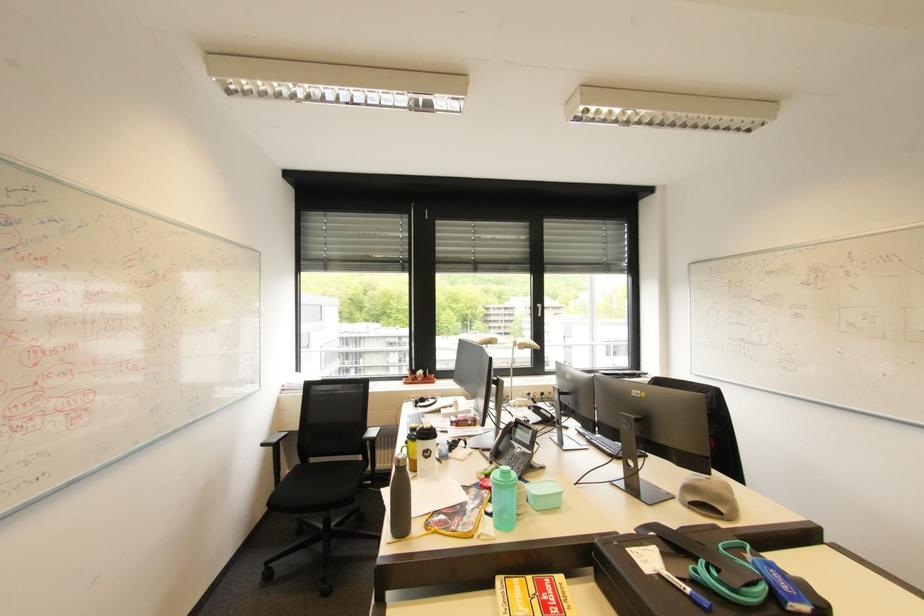
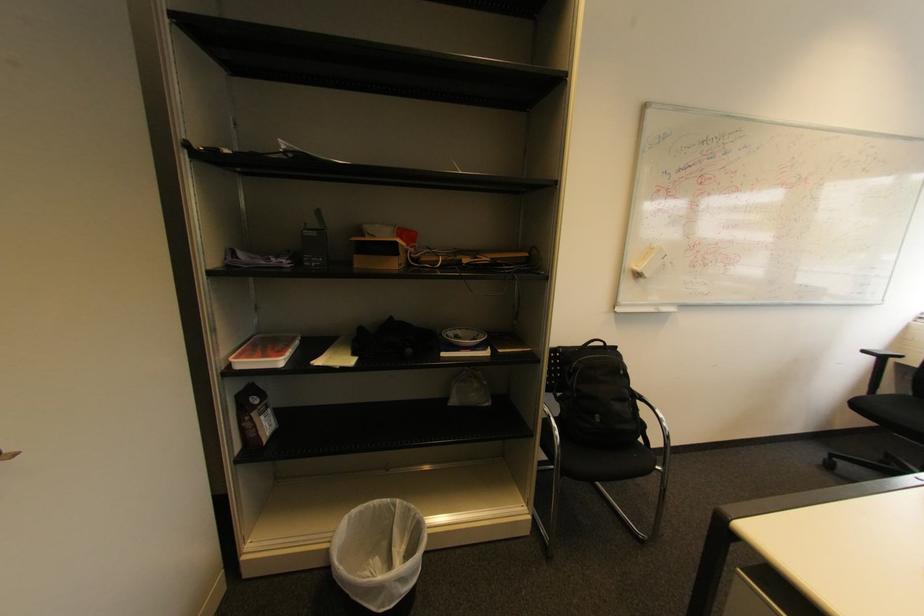
Question: The images are taken continuously from a first-person perspective. In which direction is your viewpoint rotating?

Choices:
 (A) Left
 (B) Right
 (C) Up
 (D) Down

Answer: (A)